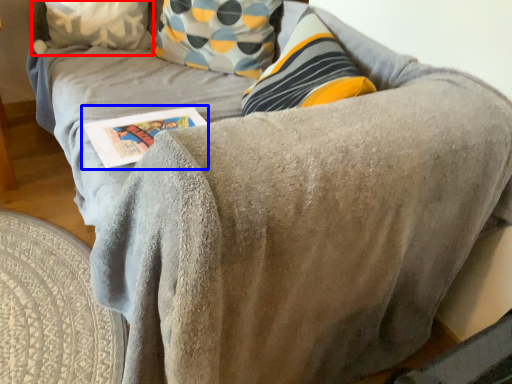
Question: Among these objects, which one is farthest to the camera, pillow (highlighted by a red box) or paperback book (highlighted by a blue box)?

Choices:
 (A) pillow
 (B) paperback book

Answer: (A)